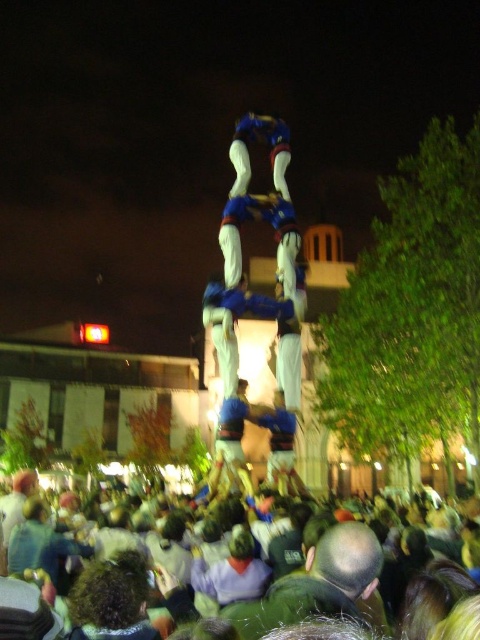
Is point (229, 250) closer to camera compared to point (279, 156)?

Yes, it is in front of point (279, 156).

Can you confirm if blue fabric human at center is bigger than blue fabric pants at center?

Yes, blue fabric human at center is bigger than blue fabric pants at center.

Is point (287, 154) behind point (286, 132)?

No, it is in front of (286, 132).

This screenshot has width=480, height=640. Identify the location of blue fabric human at center. (240, 260).

Looking at this image, who is more distant from viewer, (78, 582) or (272, 134)?

The point (272, 134) is behind.

Does dark green fabric crowd at lower center lie in front of blue fabric pants at center?

Yes, dark green fabric crowd at lower center is closer to the viewer.

Is point (51, 525) positioned behind point (269, 132)?

No, it is not.

Find the location of a particular element. The image size is (480, 640). dark green fabric crowd at lower center is located at coordinates (283, 589).

Between point (282, 516) and point (269, 202), which one is positioned behind?

The point (269, 202) is more distant.

Between dark green fabric crowd at lower center and blue fabric human at center, which one is positioned higher?

blue fabric human at center

Image resolution: width=480 pixels, height=640 pixels. What do you see at coordinates (283, 589) in the screenshot?
I see `dark green fabric crowd at lower center` at bounding box center [283, 589].

The image size is (480, 640). I want to click on dark green fabric crowd at lower center, so click(283, 589).